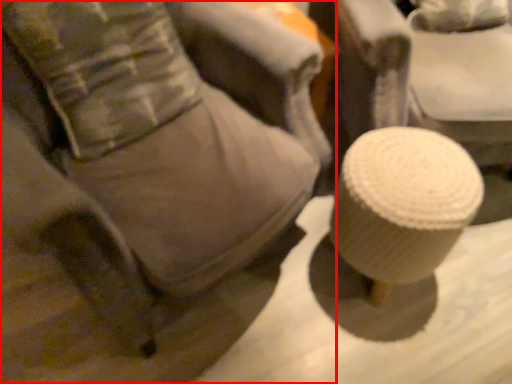
Question: Considering the relative positions of furniture (annotated by the red box) and pillow in the image provided, where is furniture (annotated by the red box) located with respect to the staircase?

Choices:
 (A) left
 (B) right

Answer: (B)